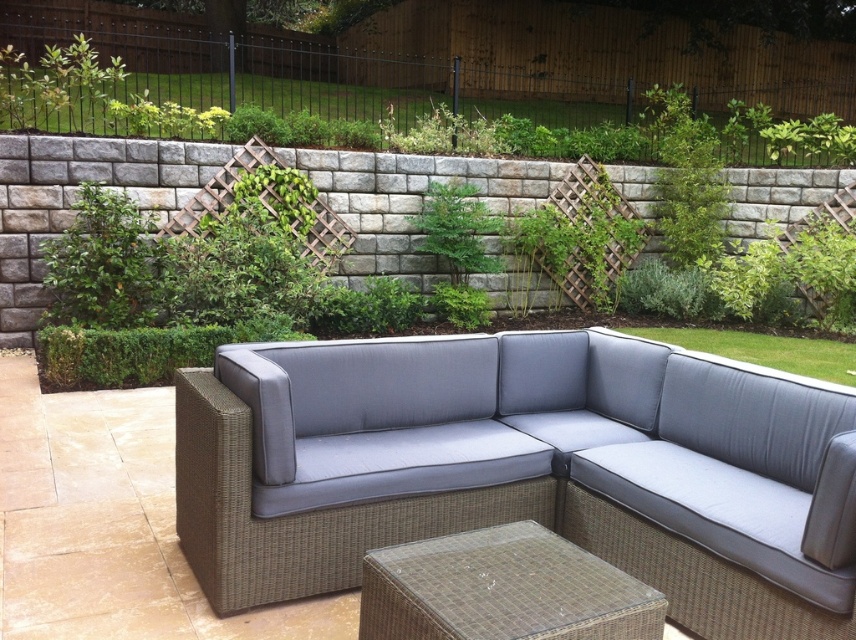
Is woven rattan couch at center shorter than woven rattan side table at lower center?

No, woven rattan couch at center is not shorter than woven rattan side table at lower center.

Locate an element on the screen. This screenshot has width=856, height=640. woven rattan couch at center is located at coordinates (522, 468).

Who is more distant from viewer, (648, 410) or (462, 547)?

Point (648, 410)

Identify the location of woven rattan couch at center. This screenshot has height=640, width=856. (522, 468).